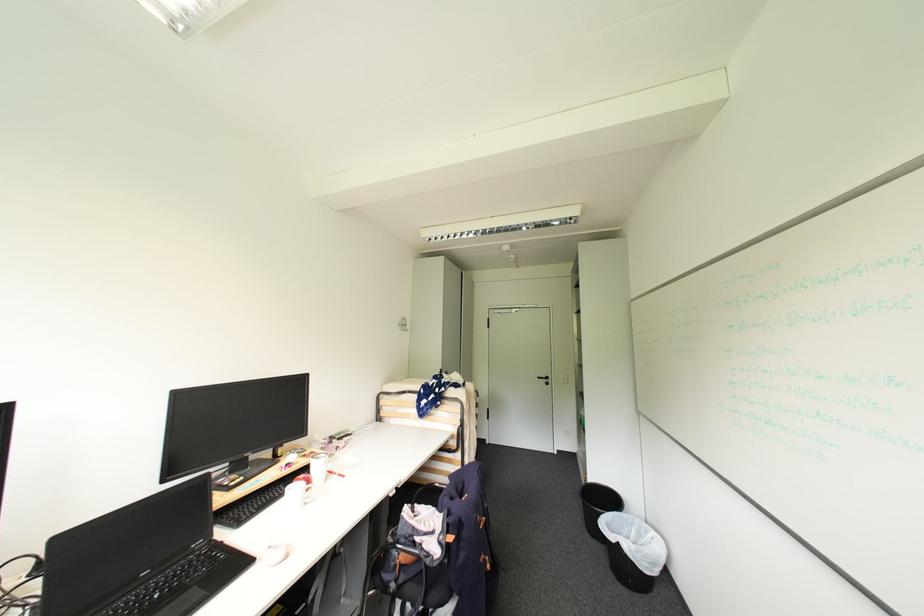
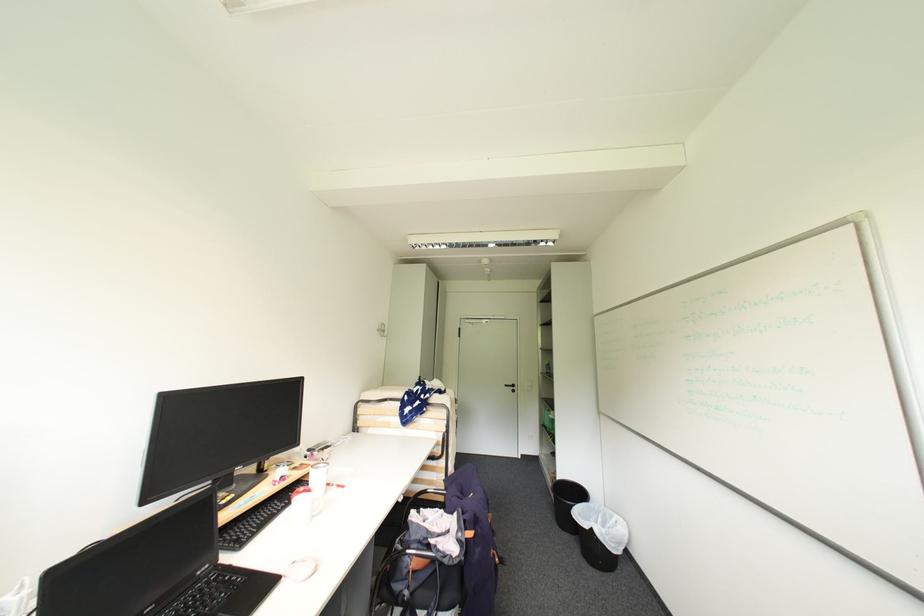
Where in the second image is the point corresponding to [406,325] from the first image?

(384, 331)